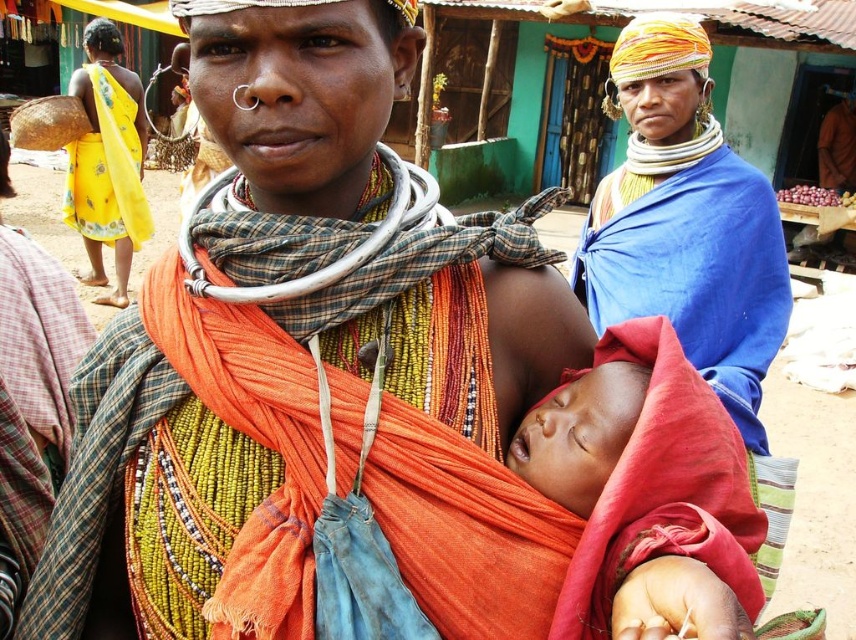
Is blue fabric at upper right thinner than soft red cloth at center?

Incorrect, blue fabric at upper right's width is not less than soft red cloth at center's.

Describe the element at coordinates (685, 221) in the screenshot. The width and height of the screenshot is (856, 640). I see `blue fabric at upper right` at that location.

I want to click on blue fabric at upper right, so click(685, 221).